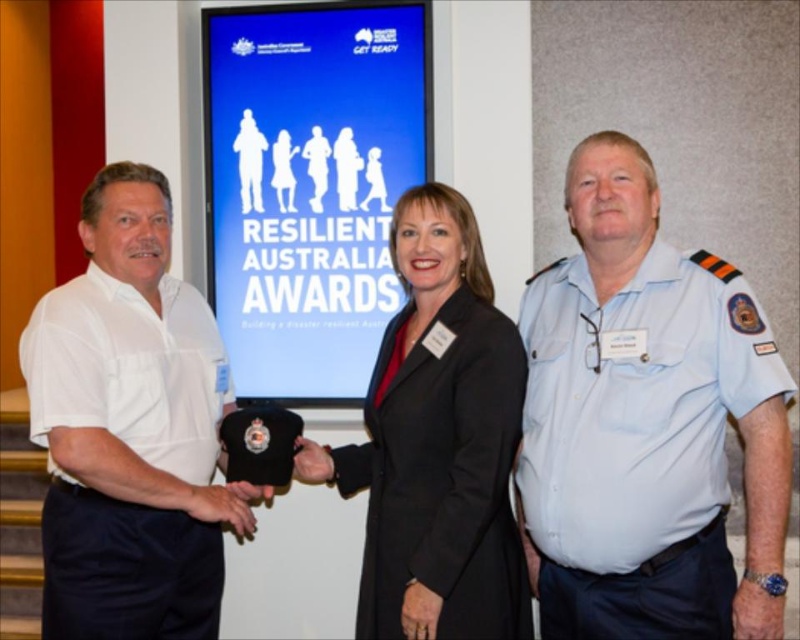
Based on the scene description, where is the light blue uniform at center located in the image?

Answer: The light blue uniform at center is located at point 0.664 on the horizontal axis and 0.809 on the vertical axis.

You are organizing a photo shoot and need to ensure that the blue paper at center and the black fabric coat at center are at least 24 inches apart for proper framing. Based on the scene, will this requirement be met?

The blue paper at center and the black fabric coat at center are 24.76 inches apart, which meets the requirement of at least 24 inches apart for proper framing.